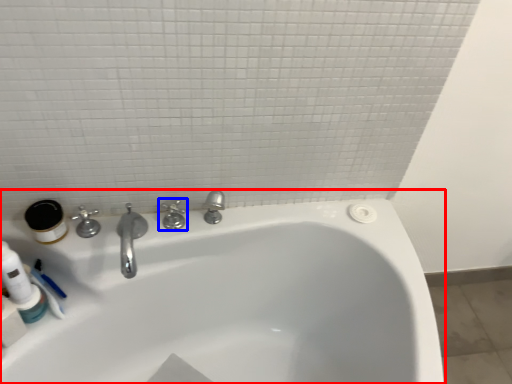
Question: Which of the following is the closest to the observer, bathtub (highlighted by a red box) or tap (highlighted by a blue box)?

Choices:
 (A) bathtub
 (B) tap

Answer: (A)